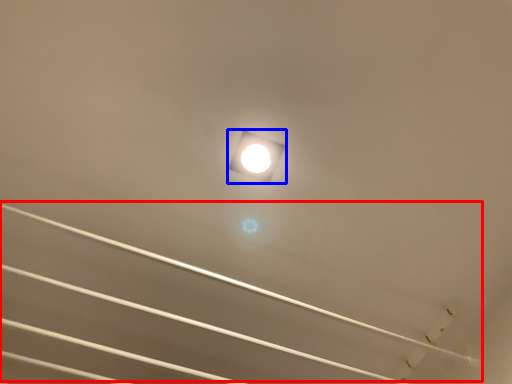
Question: Which object appears closest to the camera in this image, line (highlighted by a red box) or lamp (highlighted by a blue box)?

Choices:
 (A) line
 (B) lamp

Answer: (A)